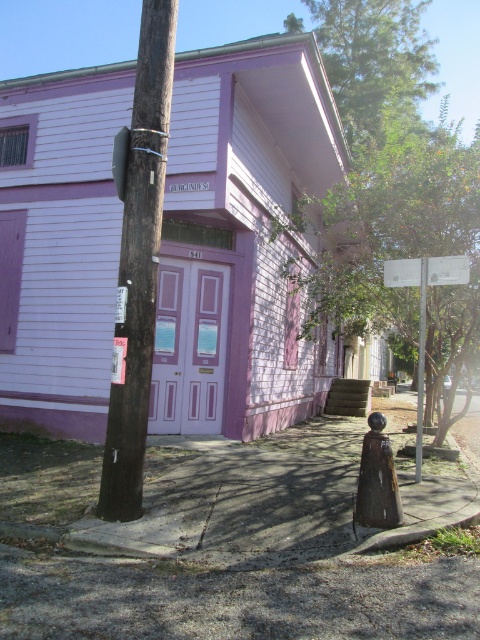
You are standing on the sidewalk in front of the building. Where is the green leafy tree at upper center located relative to your position?

The green leafy tree at upper center is located at the upper center position relative to your position on the sidewalk in front of the building.

You are a pedestrian standing on the sidewalk in front of the building. You see the green leafy tree at upper center and the metallic silver sign at center. Which object is casting a shadow on the other?

The green leafy tree at upper center is positioned over the metallic silver sign at center, so it is casting a shadow on the metallic silver sign at center.